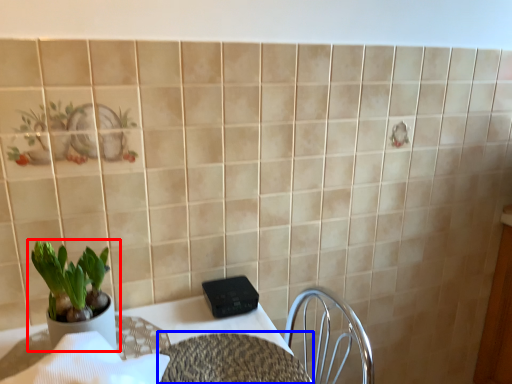
Question: Which object appears closest to the camera in this image, houseplant (highlighted by a red box) or round table (highlighted by a blue box)?

Choices:
 (A) houseplant
 (B) round table

Answer: (B)